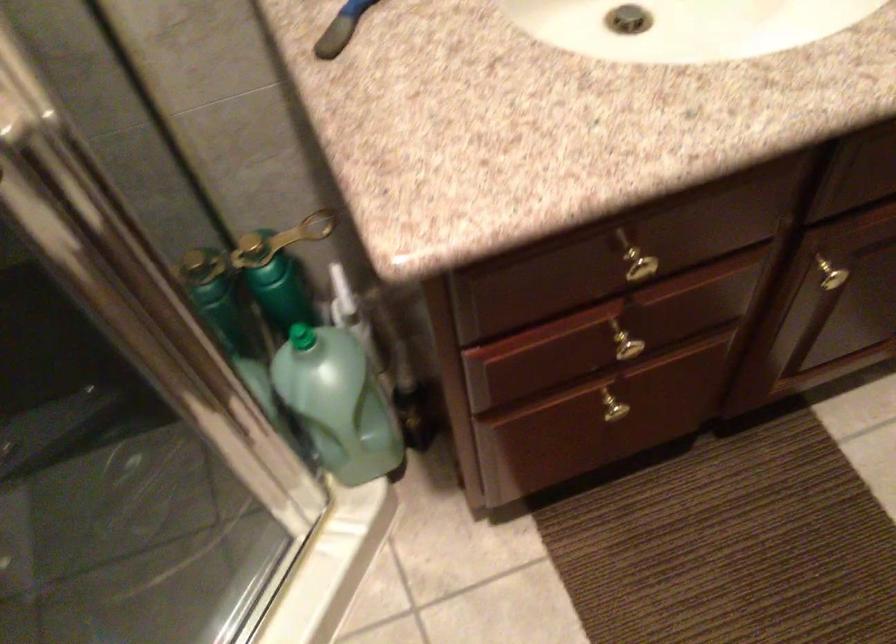
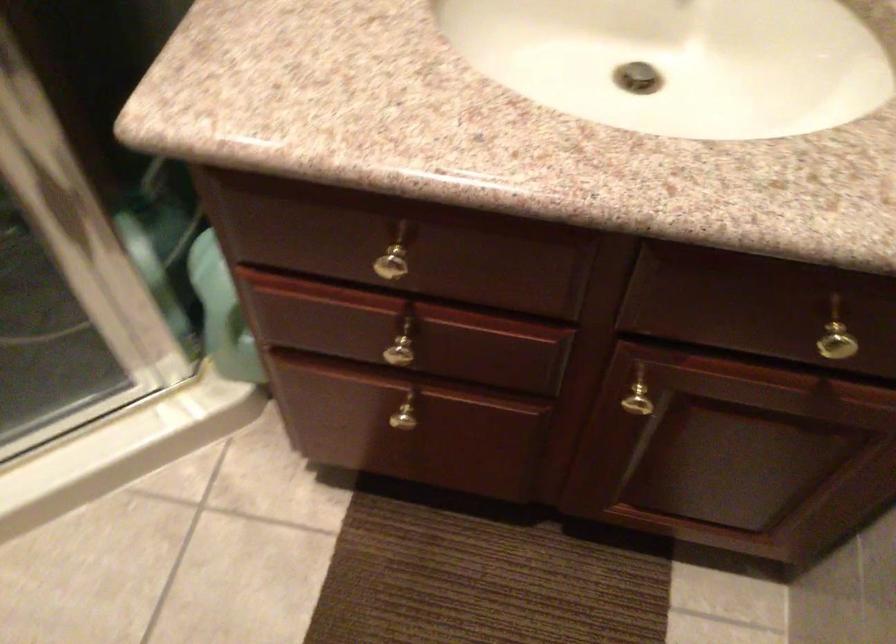
Question: The first image is from the beginning of the video and the second image is from the end. How did the camera likely rotate when shooting the video?

Choices:
 (A) Left
 (B) Right
 (C) Up
 (D) Down

Answer: (A)